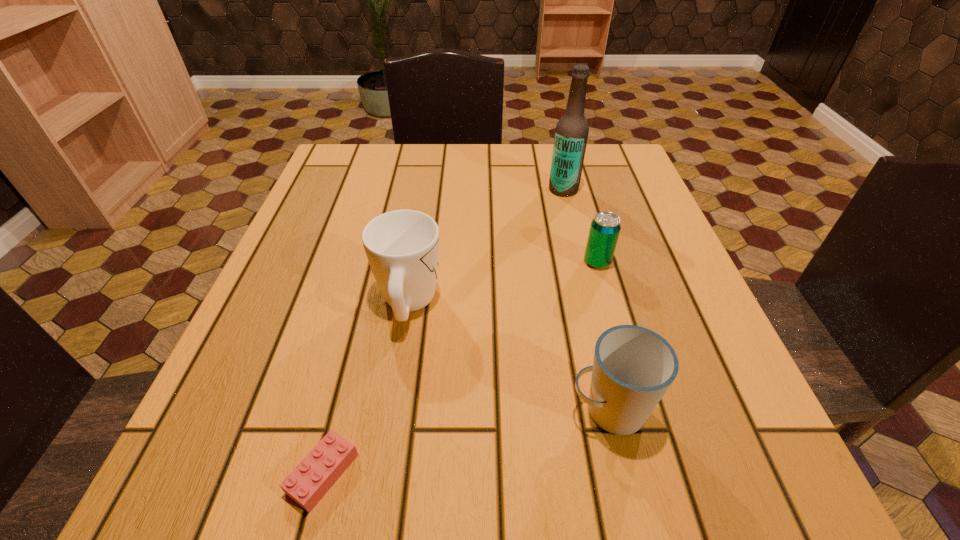
In order to click on vacant space at the left edge of the desktop in this screenshot , I will do `click(275, 324)`.

You are a GUI agent. You are given a task and a screenshot of the screen. Output one action in this format:
    pyautogui.click(x=<x>, y=<y>)
    Task: Click on the free region at the right edge of the desktop
    The image size is (960, 540).
    Given the screenshot: What is the action you would take?
    pyautogui.click(x=630, y=260)

Identify the location of vacant area at the far left corner. (x=392, y=150).

Identify the location of free space at the near left corner. (231, 469).

Locate an element on the screen. free location at the far right corner is located at coordinates (609, 166).

This screenshot has height=540, width=960. Find the location of `free spot at the near right corner of the desktop`. free spot at the near right corner of the desktop is located at coordinates (717, 454).

Locate an element on the screen. This screenshot has height=540, width=960. vacant space in between the shortest object and the third farthest object is located at coordinates (366, 388).

The height and width of the screenshot is (540, 960). Identify the location of free area in between the shortest object and the cup. (466, 442).

Locate an element on the screen. This screenshot has height=540, width=960. unoccupied area between the beer can and the mug is located at coordinates (503, 282).

The width and height of the screenshot is (960, 540). In order to click on vacant area that lies between the second farthest object and the tallest object in this screenshot , I will do `click(580, 226)`.